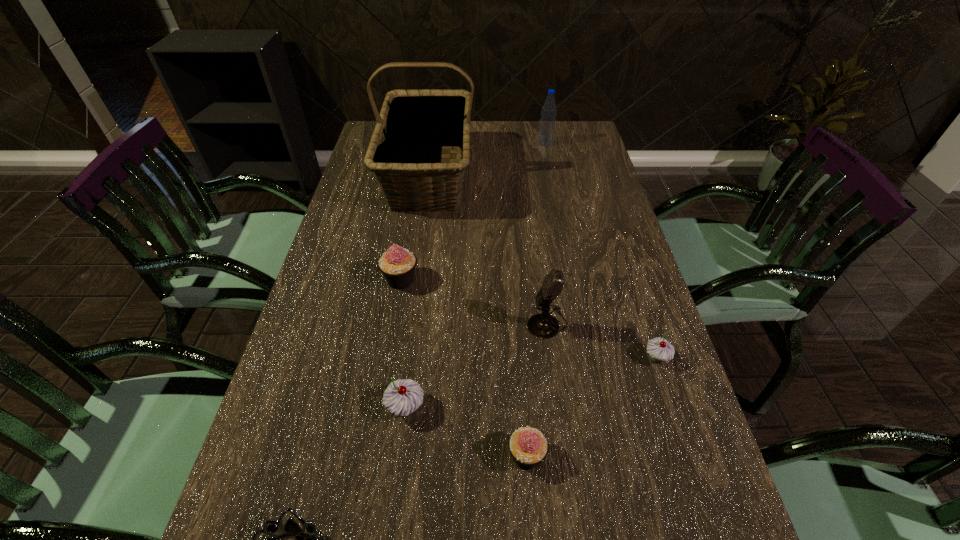
Image resolution: width=960 pixels, height=540 pixels. What are the coordinates of `empty space between the tallest object and the microphone` in the screenshot? It's located at (488, 249).

Identify the location of the third closest object to the right pink cupcake. The height and width of the screenshot is (540, 960). (291, 528).

I want to click on object that stands as the fourth closest to the left gray cupcake, so click(x=397, y=264).

Select which cupcake appears as the fourth closest to the blue water bottle. Please provide its 2D coordinates. Your answer should be formatted as a tuple, i.e. [(x, y)], where the tuple contains the x and y coordinates of a point satisfying the conditions above.

[(528, 446)]

Where is `the third closest cupcake to the bigger pink cupcake`? The height and width of the screenshot is (540, 960). the third closest cupcake to the bigger pink cupcake is located at coordinates (659, 349).

The image size is (960, 540). I want to click on free region that satisfies the following two spatial constraints: 1. on the back side of the smaller gray cupcake; 2. on the front-facing side of the microphone, so click(645, 323).